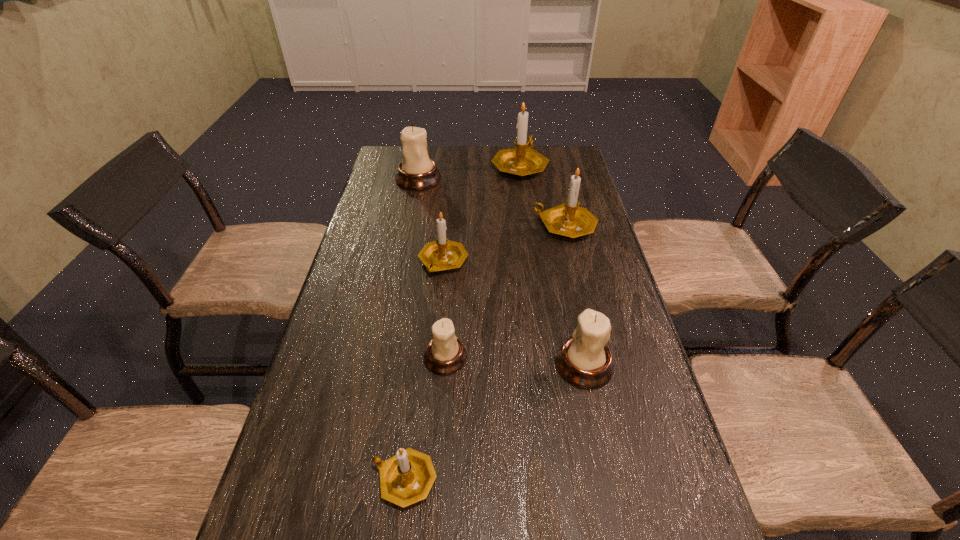
Where is `free region located 0.360m on the front of the tallest candle holder`? free region located 0.360m on the front of the tallest candle holder is located at coordinates (530, 246).

The image size is (960, 540). In order to click on vacant space situated on the left of the leftmost white candle holder in this screenshot , I will do `click(382, 179)`.

Where is `vacant area situated on the front of the second biggest gold candle holder`? Image resolution: width=960 pixels, height=540 pixels. vacant area situated on the front of the second biggest gold candle holder is located at coordinates (589, 330).

You are a GUI agent. You are given a task and a screenshot of the screen. Output one action in this format:
    pyautogui.click(x=<x>, y=<y>)
    Task: Click on the free spot located 0.070m on the back of the second smallest gold candle holder
    The image size is (960, 540).
    Given the screenshot: What is the action you would take?
    pyautogui.click(x=446, y=230)

The image size is (960, 540). In order to click on free space located on the back of the rightmost white candle holder in this screenshot , I will do `click(559, 243)`.

Locate an element on the screen. This screenshot has width=960, height=540. free space located 0.120m on the back of the smallest white candle holder is located at coordinates (449, 305).

Where is `vacant space located on the back of the smallest gold candle holder`? This screenshot has width=960, height=540. vacant space located on the back of the smallest gold candle holder is located at coordinates (426, 303).

Find the location of a particular element. The image size is (960, 540). object at the left edge is located at coordinates (416, 171).

This screenshot has width=960, height=540. Identify the location of object that is at the far left corner. (416, 171).

The image size is (960, 540). I want to click on object at the far right corner, so click(x=523, y=160).